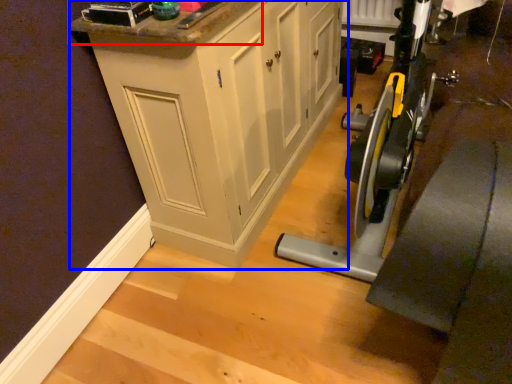
Question: Which object appears closest to the camera in this image, counter top (highlighted by a red box) or cabinetry (highlighted by a blue box)?

Choices:
 (A) counter top
 (B) cabinetry

Answer: (A)